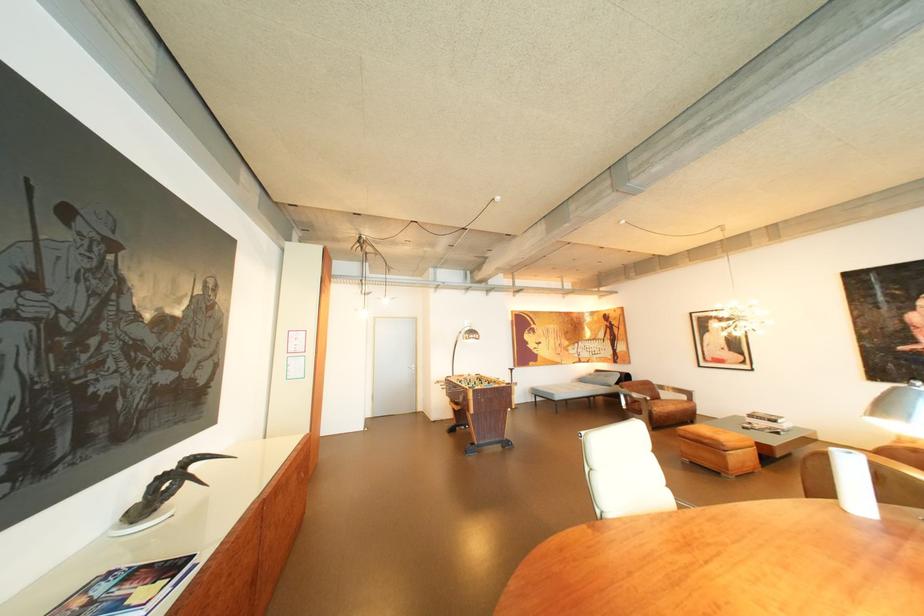
The height and width of the screenshot is (616, 924). I want to click on brown chair armrest, so click(x=638, y=395).